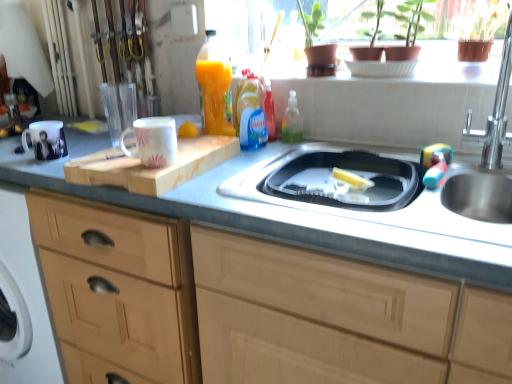
Based on the photo, measure the distance between yellow rubber sponge at sink, the second food when ordered from left to right, and camera.

They are 3.34 feet apart.

What do you see at coordinates (152, 168) in the screenshot?
I see `wooden cutting board at center` at bounding box center [152, 168].

Measure the distance between blue translucent dish soap at center and camera.

A distance of 3.76 feet exists between blue translucent dish soap at center and camera.

Where is `yellow rubber sponge at sink, positioned as the 1th food in right-to-left order`? The height and width of the screenshot is (384, 512). yellow rubber sponge at sink, positioned as the 1th food in right-to-left order is located at coordinates (352, 179).

Is wooden cabinet at left, which is counted as the 1th cabinetry, starting from the right, facing towards yellow matte lemon at center, the 2th food when ordered from right to left?

No, wooden cabinet at left, which is counted as the 1th cabinetry, starting from the right, is not turned towards yellow matte lemon at center, the 2th food when ordered from right to left.

Is wooden cabinet at left, placed as the 2th cabinetry when sorted from left to right, placed right next to yellow matte lemon at center, the 2th food when ordered from right to left?

No, wooden cabinet at left, placed as the 2th cabinetry when sorted from left to right, is not with yellow matte lemon at center, the 2th food when ordered from right to left.

The height and width of the screenshot is (384, 512). I want to click on the 2nd food above the wooden cabinet at left, which is counted as the 1th cabinetry, starting from the right (from the image's perspective), so (188, 130).

Which is in front, wooden cabinet at left, which is counted as the 1th cabinetry, starting from the right, or yellow matte lemon at center, the 1th food in the left-to-right sequence?

wooden cabinet at left, which is counted as the 1th cabinetry, starting from the right, is closer to the camera.

How different are the orientations of wooden cabinet at left, which is counted as the 1th cabinetry, starting from the right, and stainless steel sink at center, which is the second sink from top to bottom, in degrees?

0.305 degrees separate the facing orientations of wooden cabinet at left, which is counted as the 1th cabinetry, starting from the right, and stainless steel sink at center, which is the second sink from top to bottom.

Is stainless steel sink at center, which is the second sink from top to bottom, a part of wooden cabinet at left, placed as the 2th cabinetry when sorted from left to right?

Yes, wooden cabinet at left, placed as the 2th cabinetry when sorted from left to right, contains stainless steel sink at center, which is the second sink from top to bottom.

At what (x,y) coordinates should I click in order to perform the action: click on the 1st sink positioned above the wooden cabinet at left, placed as the 2th cabinetry when sorted from left to right (from a real-world perspective). Please return your answer as a coordinate pair (x, y). Looking at the image, I should click on (382, 192).

Is point (215, 268) positioned behind point (386, 163)?

No, it is in front of (386, 163).

How different are the orientations of yellow rubber sponge at sink, positioned as the 1th food in bottom-to-top order, and stainless steel sink at right, marked as the 1th sink in a top-to-bottom arrangement, in degrees?

The angular difference between yellow rubber sponge at sink, positioned as the 1th food in bottom-to-top order, and stainless steel sink at right, marked as the 1th sink in a top-to-bottom arrangement, is 27.7 degrees.

Which object is more forward, yellow rubber sponge at sink, the second food when ordered from left to right, or stainless steel sink at right, marked as the 1th sink in a top-to-bottom arrangement?

stainless steel sink at right, marked as the 1th sink in a top-to-bottom arrangement, is in front.

Considering the points (351, 178) and (503, 191), which point is in front, point (351, 178) or point (503, 191)?

Point (503, 191)

From the image's perspective, is yellow rubber sponge at sink, positioned as the 1th food in right-to-left order, positioned above or below stainless steel sink at right, marked as the 1th sink in a top-to-bottom arrangement?

From the image's perspective, yellow rubber sponge at sink, positioned as the 1th food in right-to-left order, appears below stainless steel sink at right, marked as the 1th sink in a top-to-bottom arrangement.

Is light wood cabinet at left, which is counted as the second cabinetry, starting from the right, surrounding stainless steel sink at right, marked as the 1th sink in a top-to-bottom arrangement?

No, light wood cabinet at left, which is counted as the second cabinetry, starting from the right, does not contain stainless steel sink at right, marked as the 1th sink in a top-to-bottom arrangement.

Which is in front, point (108, 311) or point (506, 60)?

The point (506, 60) is closer.

Is light wood cabinet at left, which is counted as the second cabinetry, starting from the right, to the right of stainless steel sink at right, marked as the 1th sink in a top-to-bottom arrangement, from the viewer's perspective?

In fact, light wood cabinet at left, which is counted as the second cabinetry, starting from the right, is to the left of stainless steel sink at right, marked as the 1th sink in a top-to-bottom arrangement.

Locate an element on the screen. Image resolution: width=512 pixels, height=384 pixels. the 2nd cabinetry below the stainless steel sink at right, which appears as the 2th sink when ordered from the bottom (from a real-world perspective) is located at coordinates (118, 289).

You are a GUI agent. You are given a task and a screenshot of the screen. Output one action in this format:
    pyautogui.click(x=<x>, y=<y>)
    Task: Click on the mug that appears behind the light wood cabinet at left, placed as the 1th cabinetry when sorted from left to right
    
    Given the screenshot: What is the action you would take?
    pyautogui.click(x=46, y=140)

From a real-world perspective, which is physically below, light wood cabinet at left, placed as the 1th cabinetry when sorted from left to right, or white glossy mug at left, which ranks as the 2th mug in right-to-left order?

light wood cabinet at left, placed as the 1th cabinetry when sorted from left to right.

Can we say light wood cabinet at left, which is counted as the second cabinetry, starting from the right, lies outside white glossy mug at left, acting as the 2th mug starting from the front?

Yes, light wood cabinet at left, which is counted as the second cabinetry, starting from the right, is located beyond the bounds of white glossy mug at left, acting as the 2th mug starting from the front.

Is wooden cutting board at center facing towards stainless steel sink at center, the 1th sink ordered from the bottom?

No, wooden cutting board at center is not facing towards stainless steel sink at center, the 1th sink ordered from the bottom.

Based on their positions, is wooden cutting board at center located to the left or right of stainless steel sink at center, the 1th sink ordered from the bottom?

From the image, it's evident that wooden cutting board at center is to the left of stainless steel sink at center, the 1th sink ordered from the bottom.

Considering the positions of points (222, 160) and (232, 196), is point (222, 160) farther from camera compared to point (232, 196)?

That is True.

Considering the sizes of objects wooden cutting board at center and stainless steel sink at center, the 1th sink ordered from the bottom, in the image provided, who is wider, wooden cutting board at center or stainless steel sink at center, the 1th sink ordered from the bottom,?

Wider between the two is stainless steel sink at center, the 1th sink ordered from the bottom.

Does stainless steel sink at right, marked as the 1th sink in a top-to-bottom arrangement, have a greater width compared to light wood cabinet at left, which is counted as the second cabinetry, starting from the right?

In fact, stainless steel sink at right, marked as the 1th sink in a top-to-bottom arrangement, might be narrower than light wood cabinet at left, which is counted as the second cabinetry, starting from the right.

Which object is positioned more to the left, stainless steel sink at right, marked as the 1th sink in a top-to-bottom arrangement, or light wood cabinet at left, placed as the 1th cabinetry when sorted from left to right?

Positioned to the left is light wood cabinet at left, placed as the 1th cabinetry when sorted from left to right.

How different are the orientations of stainless steel sink at right, marked as the 1th sink in a top-to-bottom arrangement, and light wood cabinet at left, placed as the 1th cabinetry when sorted from left to right, in degrees?

There is a 0.262-degree angle between the facing directions of stainless steel sink at right, marked as the 1th sink in a top-to-bottom arrangement, and light wood cabinet at left, placed as the 1th cabinetry when sorted from left to right.

From a real-world perspective, is stainless steel sink at right, which appears as the 2th sink when ordered from the bottom, on light wood cabinet at left, placed as the 1th cabinetry when sorted from left to right?

Correct, in the physical world, stainless steel sink at right, which appears as the 2th sink when ordered from the bottom, is higher than light wood cabinet at left, placed as the 1th cabinetry when sorted from left to right.

At what (x,y) coordinates should I click in order to perform the action: click on the 2nd food above the wooden cabinet at left, placed as the 2th cabinetry when sorted from left to right (from the image's perspective). Please return your answer as a coordinate pair (x, y). The width and height of the screenshot is (512, 384). Looking at the image, I should click on (188, 130).

I want to click on the 1st cabinetry to the left of the stainless steel sink at center, the 1th sink ordered from the bottom, starting your count from the anchor, so click(338, 318).

Which object lies nearer to the anchor point white glossy mug at left, acting as the 2th mug starting from the front, white glossy mug at upper center, marked as the first mug in a right-to-left arrangement, or wooden cutting board at center?

Based on the image, white glossy mug at upper center, marked as the first mug in a right-to-left arrangement, appears to be nearer to white glossy mug at left, acting as the 2th mug starting from the front.

Which object lies further to the anchor point blue translucent dish soap at center, yellow rubber sponge at sink, positioned as the 1th food in bottom-to-top order, or light wood cabinet at left, which is counted as the second cabinetry, starting from the right?

light wood cabinet at left, which is counted as the second cabinetry, starting from the right, is positioned further to the anchor blue translucent dish soap at center.

From the image, which object appears to be farther from wooden cutting board at center, wooden cabinet at left, which is counted as the 1th cabinetry, starting from the right, or white glossy mug at left, arranged as the 1th mug when viewed from the back?

white glossy mug at left, arranged as the 1th mug when viewed from the back, is further to wooden cutting board at center.

Considering their positions, is stainless steel sink at right, which appears as the 2th sink when ordered from the bottom, positioned closer to yellow matte lemon at center, the second food positioned from the bottom, than blue translucent dish soap at center?

blue translucent dish soap at center lies closer to yellow matte lemon at center, the second food positioned from the bottom, than the other object.

Which object lies nearer to the anchor point light wood cabinet at left, which is counted as the second cabinetry, starting from the right, stainless steel sink at center, the 1th sink ordered from the bottom, or white glossy mug at left, which ranks as the 2th mug in right-to-left order?

Among the two, white glossy mug at left, which ranks as the 2th mug in right-to-left order, is located nearer to light wood cabinet at left, which is counted as the second cabinetry, starting from the right.

Consider the image. Looking at the image, which one is located further to yellow rubber sponge at sink, the second food when ordered from left to right, wooden cutting board at center or yellow matte lemon at center, the 1th food from the back?

yellow matte lemon at center, the 1th food from the back.

Based on their spatial positions, is wooden cabinet at left, which is counted as the 1th cabinetry, starting from the right, or white glossy mug at upper center, which is the 2th mug in left-to-right order, further from stainless steel sink at right, marked as the 1th sink in a top-to-bottom arrangement?

Among the two, white glossy mug at upper center, which is the 2th mug in left-to-right order, is located further to stainless steel sink at right, marked as the 1th sink in a top-to-bottom arrangement.

From the image, which object appears to be farther from wooden cutting board at center, blue translucent dish soap at center or white glossy mug at upper center, marked as the first mug in a right-to-left arrangement?

blue translucent dish soap at center lies further to wooden cutting board at center than the other object.

The width and height of the screenshot is (512, 384). In order to click on cutting board situated between white glossy mug at left, acting as the 2th mug starting from the front, and yellow matte lemon at center, the 1th food in the left-to-right sequence, from left to right in this screenshot , I will do `click(152, 168)`.

The image size is (512, 384). I want to click on sink between light wood cabinet at left, placed as the 1th cabinetry when sorted from left to right, and stainless steel sink at right, marked as the 1th sink in a top-to-bottom arrangement, from left to right, so click(x=382, y=192).

The image size is (512, 384). I want to click on cutting board between wooden cabinet at left, placed as the 2th cabinetry when sorted from left to right, and yellow matte lemon at center, placed as the 1th food when sorted from top to bottom, from front to back, so click(x=152, y=168).

Image resolution: width=512 pixels, height=384 pixels. I want to click on sink between stainless steel sink at center, which is the second sink from top to bottom, and blue translucent dish soap at center in the front-back direction, so click(479, 197).